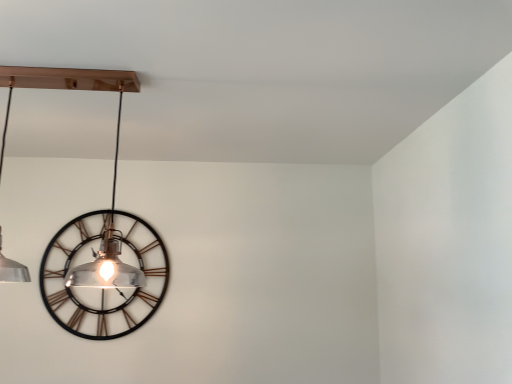
Question: Relative to metallic black clock at left, is clear glass pendant light at center in front or behind?

Choices:
 (A) front
 (B) behind

Answer: (A)

Question: Would you say clear glass pendant light at center is to the left or to the right of metallic black clock at left in the picture?

Choices:
 (A) right
 (B) left

Answer: (A)

Question: Considering the positions of clear glass pendant light at center and metallic black clock at left in the image, is clear glass pendant light at center wider or thinner than metallic black clock at left?

Choices:
 (A) wide
 (B) thin

Answer: (A)

Question: From the image's perspective, is metallic black clock at left above or below clear glass pendant light at center?

Choices:
 (A) below
 (B) above

Answer: (A)

Question: Would you say metallic black clock at left is inside or outside clear glass pendant light at center?

Choices:
 (A) inside
 (B) outside

Answer: (B)

Question: Considering the positions of metallic black clock at left and clear glass pendant light at center in the image, is metallic black clock at left wider or thinner than clear glass pendant light at center?

Choices:
 (A) wide
 (B) thin

Answer: (B)

Question: Is point pyautogui.click(x=61, y=233) positioned closer to the camera than point pyautogui.click(x=153, y=291)?

Choices:
 (A) closer
 (B) farther

Answer: (B)